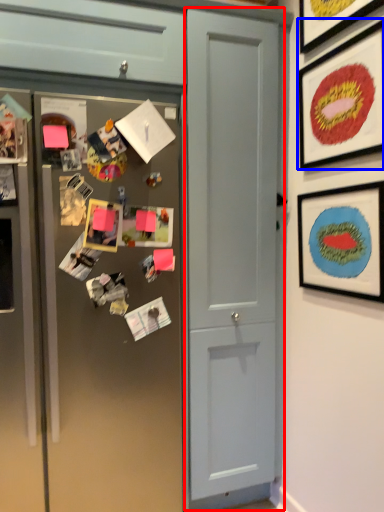
Question: Which object is closer to the camera taking this photo, door (highlighted by a red box) or picture frame (highlighted by a blue box)?

Choices:
 (A) door
 (B) picture frame

Answer: (B)